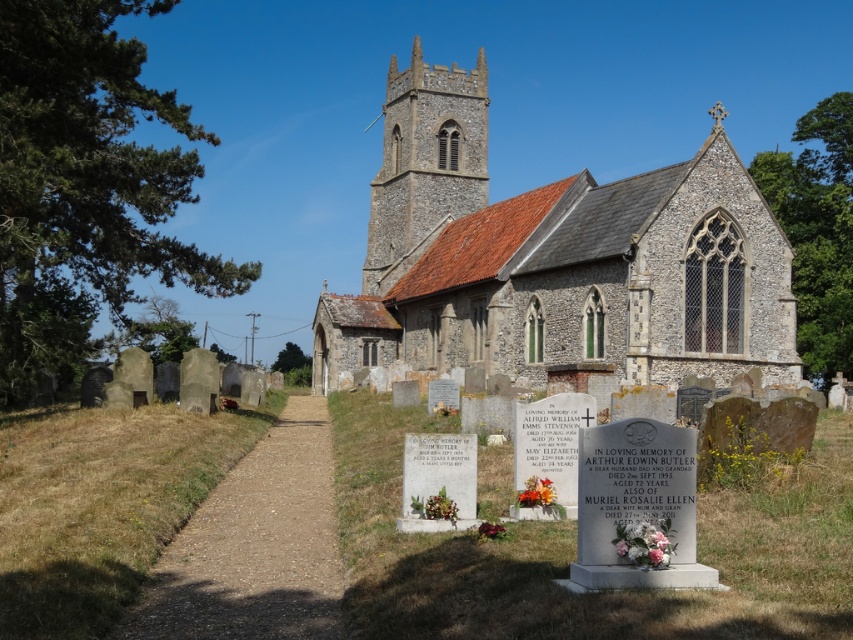
Question: Which point is closer to the camera taking this photo?

Choices:
 (A) (401, 104)
 (B) (714, 115)

Answer: (B)

Question: Is the position of stone church at center more distant than that of stone steeple at center?

Choices:
 (A) yes
 (B) no

Answer: (B)

Question: Can you confirm if stone church at center is wider than stone steeple at center?

Choices:
 (A) yes
 (B) no

Answer: (A)

Question: Does stone church at center have a lesser width compared to stone steeple at center?

Choices:
 (A) no
 (B) yes

Answer: (A)